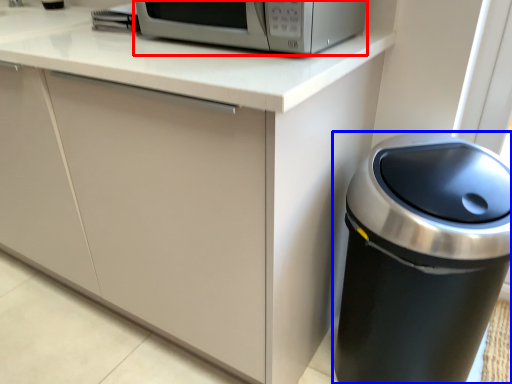
Question: Among these objects, which one is nearest to the camera, home appliance (highlighted by a red box) or waste container (highlighted by a blue box)?

Choices:
 (A) home appliance
 (B) waste container

Answer: (B)